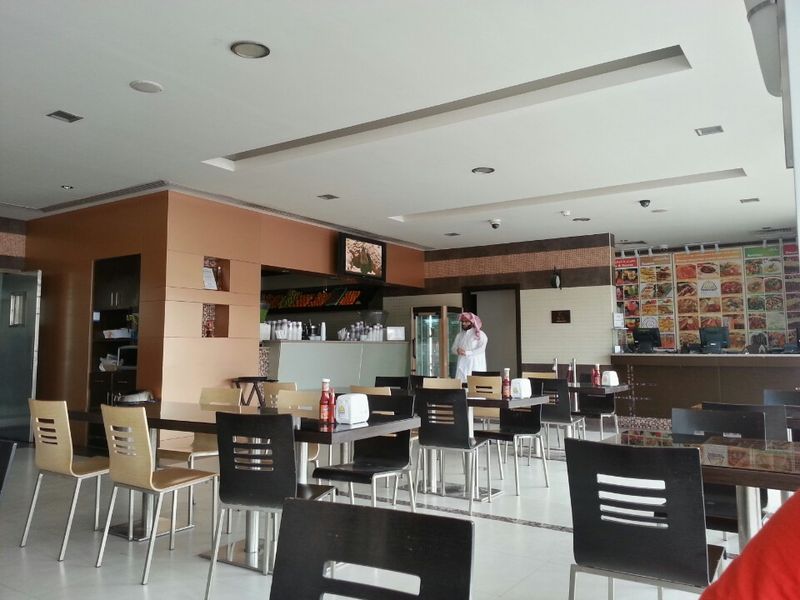
The height and width of the screenshot is (600, 800). I want to click on ceiling lights, so click(250, 51), click(477, 173).